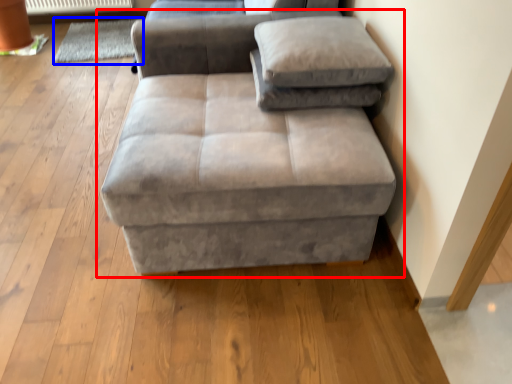
Question: Which point is closer to the camera, studio couch (highlighted by a red box) or mat (highlighted by a blue box)?

Choices:
 (A) studio couch
 (B) mat

Answer: (A)